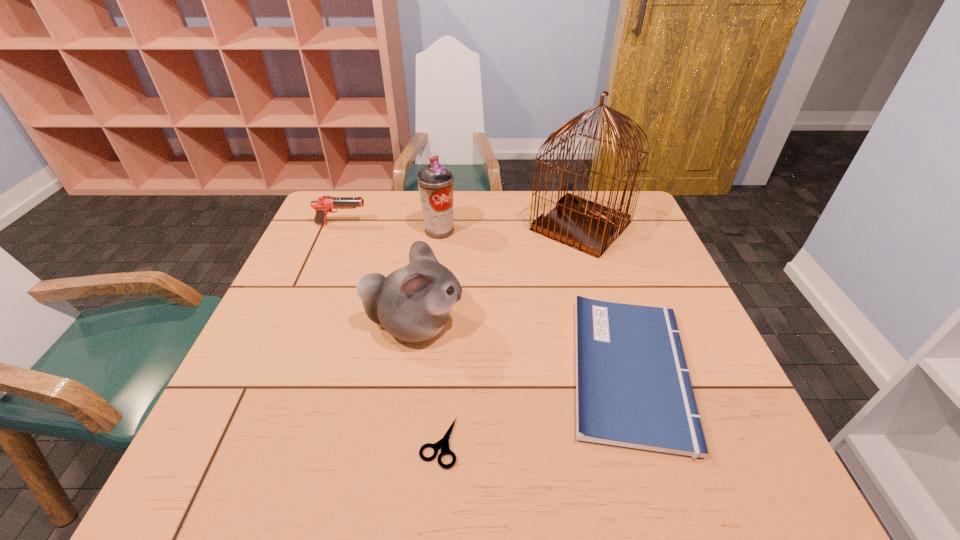
Find the location of a particular element. The width and height of the screenshot is (960, 540). paperback book located at the right edge is located at coordinates (633, 389).

Where is `object situated at the far left corner`? Image resolution: width=960 pixels, height=540 pixels. object situated at the far left corner is located at coordinates (324, 205).

Locate an element on the screen. object that is at the far right corner is located at coordinates (590, 227).

The width and height of the screenshot is (960, 540). What are the coordinates of `object situated at the near right corner` in the screenshot? It's located at (633, 389).

Locate an element on the screen. free space at the far edge of the desktop is located at coordinates coord(395,199).

Where is `free spot at the left edge of the desktop`? Image resolution: width=960 pixels, height=540 pixels. free spot at the left edge of the desktop is located at coordinates (293, 399).

The height and width of the screenshot is (540, 960). I want to click on vacant space at the right edge, so click(x=731, y=426).

Image resolution: width=960 pixels, height=540 pixels. In the image, there is a desktop. Identify the location of vacant space at the far left corner. (353, 193).

This screenshot has width=960, height=540. In the image, there is a desktop. Identify the location of free region at the near right corner. [728, 497].

Identify the location of vacant area that lies between the paperback book and the tallest object. (605, 298).